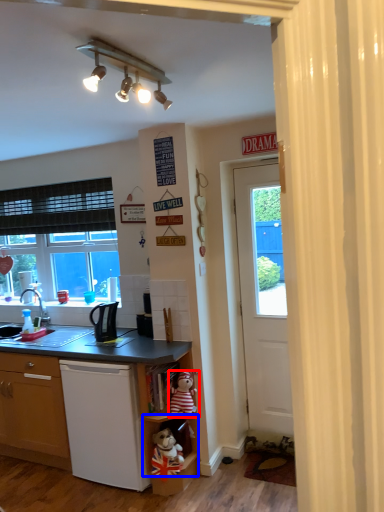
Question: Which point is closer to the camera, teddy bear (highlighted by a red box) or shelf (highlighted by a blue box)?

Choices:
 (A) teddy bear
 (B) shelf

Answer: (B)